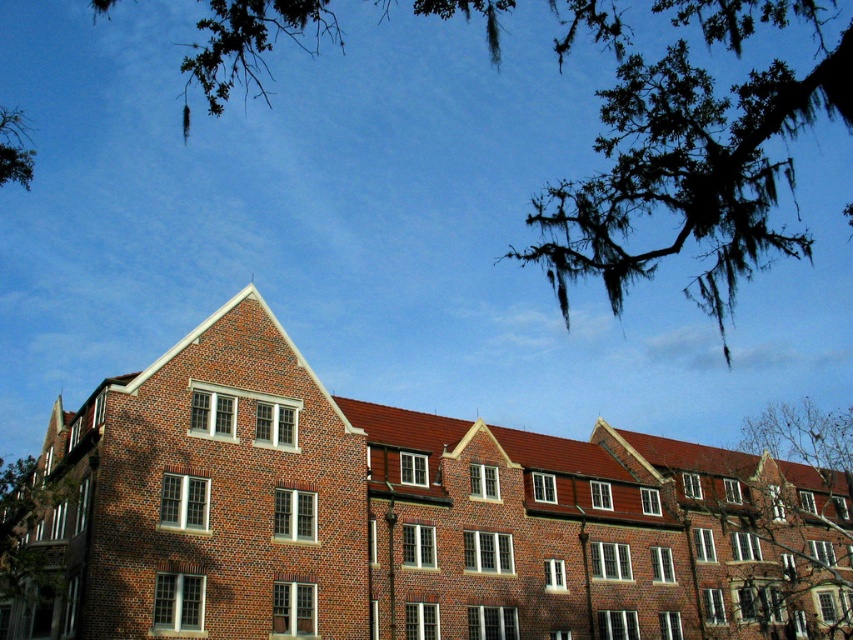
Consider the image. You are an architect analyzing the symmetry of the buildings in the image. Since both green mossy branch at upper right and green mossy branch at upper left are part of the design, which one is shorter?

The green mossy branch at upper right is shorter than the green mossy branch at upper left.

You are an architect analyzing the image. You need to determine which object occupies more vertical space in the scene. Based on the red brick building at center and the green mossy branch at upper right, which one is taller?

The red brick building at center is taller than the green mossy branch at upper right.